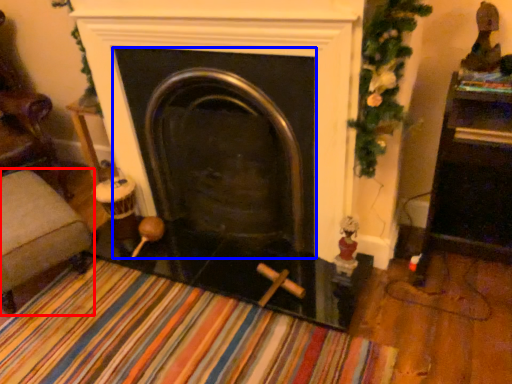
Question: Which point is further to the camera, furniture (highlighted by a red box) or fireplace (highlighted by a blue box)?

Choices:
 (A) furniture
 (B) fireplace

Answer: (A)